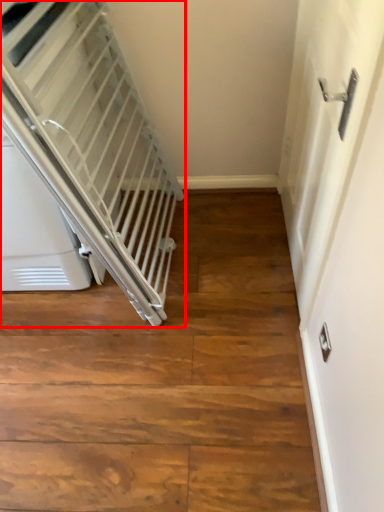
Question: In this image, where is escalator (annotated by the red box) located relative to door?

Choices:
 (A) right
 (B) left

Answer: (B)